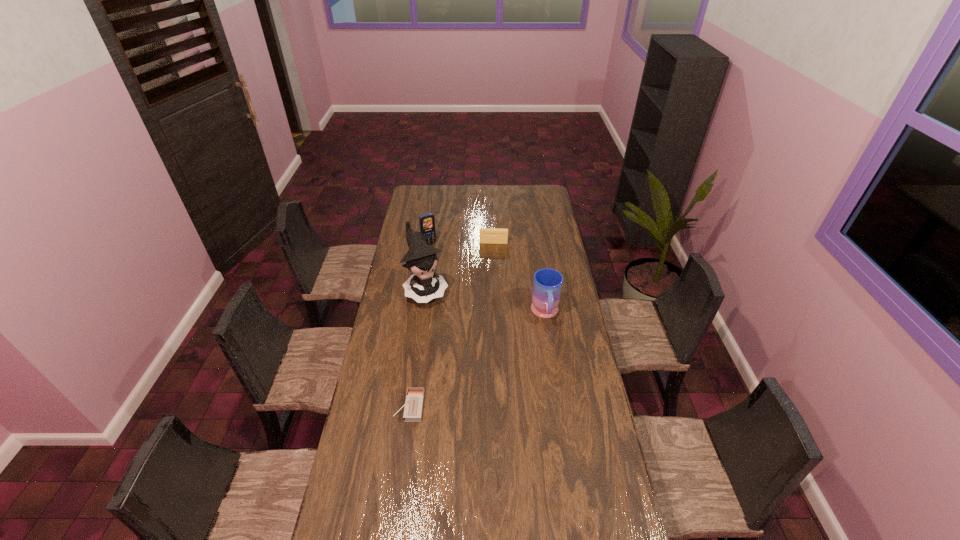
This screenshot has height=540, width=960. In order to click on the shortest object in this screenshot , I will do `click(413, 409)`.

Locate an element on the screen. The image size is (960, 540). matchbox is located at coordinates (413, 409).

Where is `mug`? mug is located at coordinates (547, 285).

The image size is (960, 540). In order to click on the second object from right to left in this screenshot , I will do `click(486, 235)`.

Image resolution: width=960 pixels, height=540 pixels. Identify the location of the fourth tallest object. (486, 235).

Identify the location of the tallest object. Image resolution: width=960 pixels, height=540 pixels. (425, 285).

Where is `cellular telephone`? This screenshot has height=540, width=960. cellular telephone is located at coordinates (427, 221).

You are a GUI agent. You are given a task and a screenshot of the screen. Output one action in this format:
    pyautogui.click(x=<x>, y=<y>)
    Task: Click on the free spot located on the striking surface of the nearest object
    The height and width of the screenshot is (540, 960).
    Given the screenshot: What is the action you would take?
    pyautogui.click(x=369, y=407)

At what (x,y) coordinates should I click in order to perform the action: click on free space located on the striking surface of the nearest object. Please return your answer as a coordinate pair (x, y). Looking at the image, I should click on (361, 407).

The image size is (960, 540). In order to click on vacant area located on the side of the rightmost object with the handle in this screenshot , I will do `click(554, 369)`.